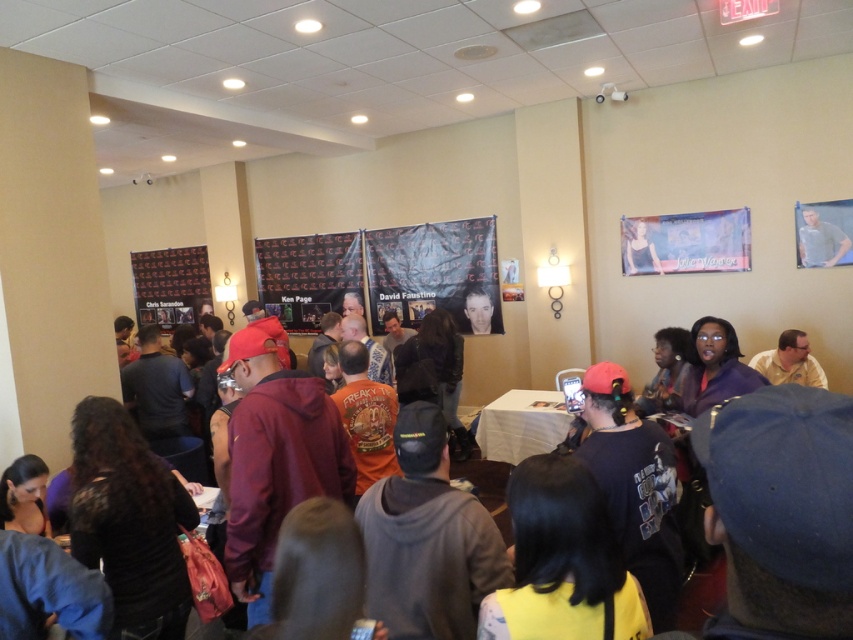
You are standing at the entrance of the convention hall and want to move towards the point labeled as point (x=811, y=605). However, there is an obstacle at point (x=538, y=392). Can you reach your destination without passing through the obstacle?

Since point (x=811, y=605) is in front of point (x=538, y=392), you can reach the destination without passing through the obstacle by moving around it.